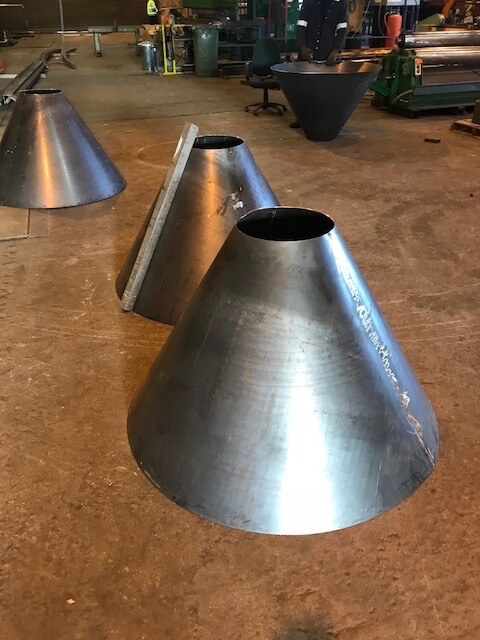
The height and width of the screenshot is (640, 480). Find the location of `chair casters`. chair casters is located at coordinates point(279,111), point(285,109), point(247,109), point(254,111).